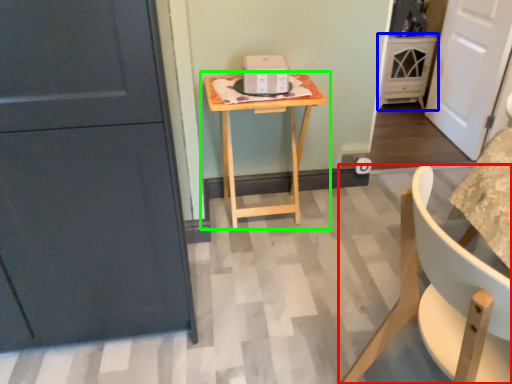
Question: Estimate the real-world distances between objects in this image. Which object is closer to chair (highlighted by a red box), cabinetry (highlighted by a blue box) or table (highlighted by a green box)?

Choices:
 (A) cabinetry
 (B) table

Answer: (B)